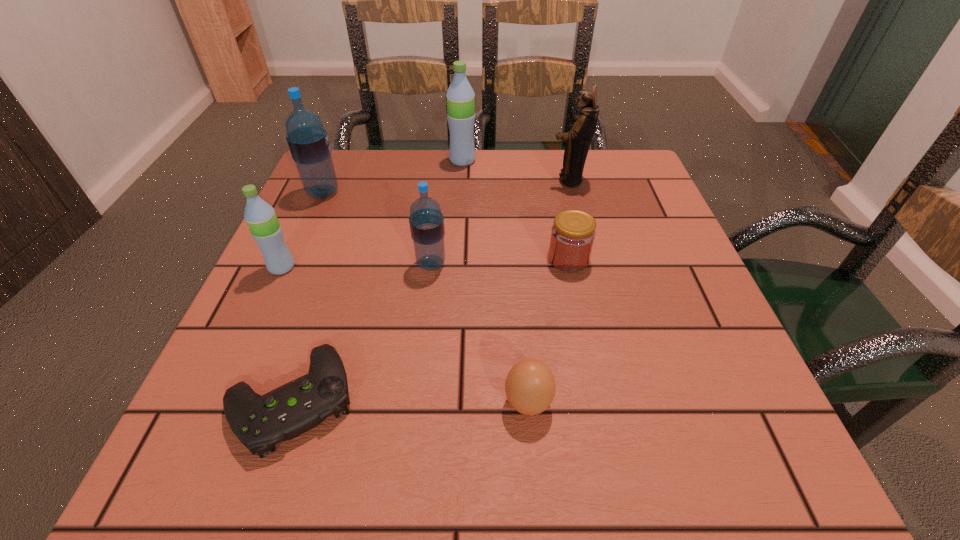
What are the coordinates of `the sixth object from left to right` in the screenshot? It's located at (530, 386).

Locate an element on the screen. This screenshot has height=540, width=960. boiled egg is located at coordinates (530, 386).

Find the location of a particular element. The image size is (960, 540). control is located at coordinates (260, 422).

Find the location of a particular element. vacant space located 0.180m on the right of the bigger green water bottle is located at coordinates (546, 160).

The width and height of the screenshot is (960, 540). I want to click on free space located 0.380m on the right of the bigger blue water bottle, so click(505, 193).

Where is `vacant area located 0.060m on the front-facing side of the figurine`? This screenshot has width=960, height=540. vacant area located 0.060m on the front-facing side of the figurine is located at coordinates (524, 180).

You are a GUI agent. You are given a task and a screenshot of the screen. Output one action in this format:
    pyautogui.click(x=<x>, y=<y>)
    Task: Click on the vacant space located 0.250m on the front-facing side of the figurine
    The image size is (960, 540).
    Given the screenshot: What is the action you would take?
    pyautogui.click(x=445, y=180)

This screenshot has height=540, width=960. Identify the location of blank space located on the front-facing side of the figurine. (458, 180).

Where is `free region located 0.180m on the right of the right blue water bottle`? The width and height of the screenshot is (960, 540). free region located 0.180m on the right of the right blue water bottle is located at coordinates (540, 264).

This screenshot has height=540, width=960. Identify the location of free space located 0.370m on the back of the left green water bottle. (331, 160).